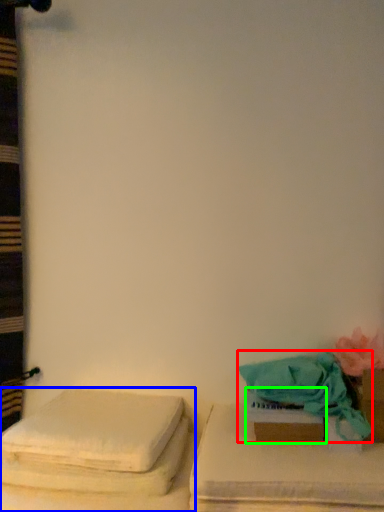
Question: Which is farther away from beach towel (highlighted by a red box)? furniture (highlighted by a blue box) or box (highlighted by a green box)?

Choices:
 (A) furniture
 (B) box

Answer: (A)